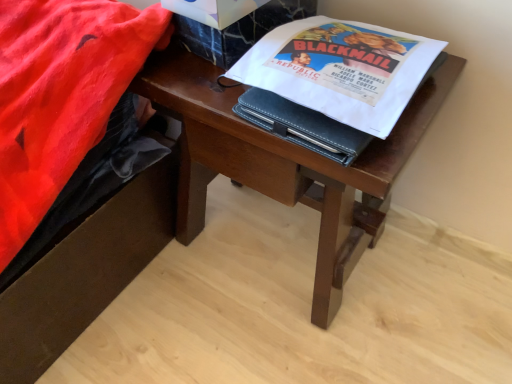
Identify the location of blank space to the left of wooden desk at center. Image resolution: width=512 pixels, height=384 pixels. (157, 302).